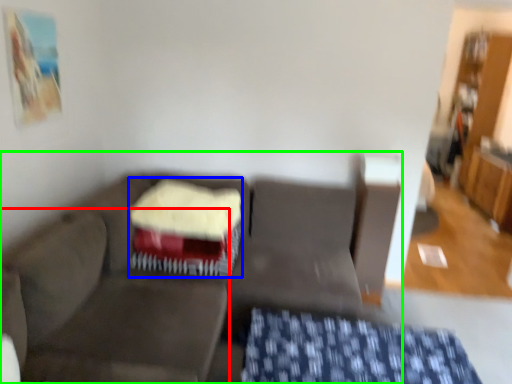
Question: Which object is positioned closest to swivel chair (highlighted by a red box)? Select from cake (highlighted by a blue box) and studio couch (highlighted by a green box).

Choices:
 (A) cake
 (B) studio couch

Answer: (B)